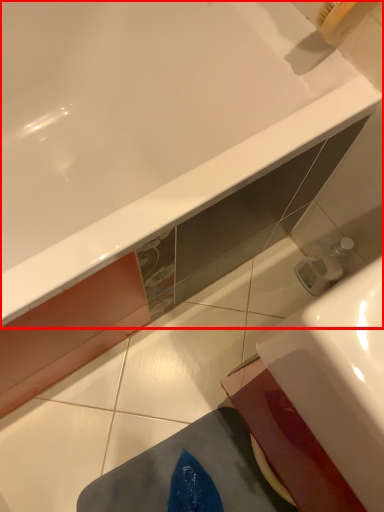
Question: In this image, where is bathtub (annotated by the red box) located relative to sink?

Choices:
 (A) right
 (B) left

Answer: (B)